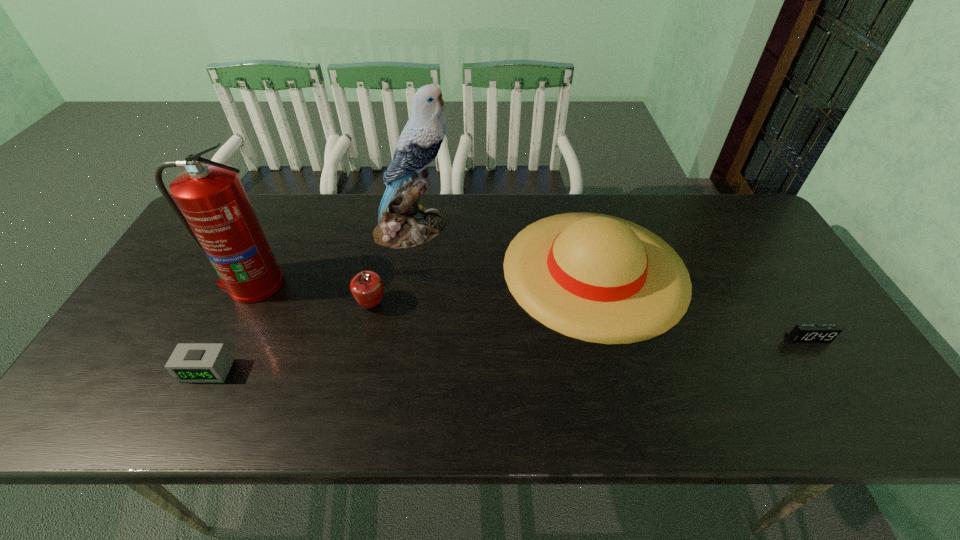
The height and width of the screenshot is (540, 960). Find the location of `blank area at the near edge`. blank area at the near edge is located at coordinates (563, 414).

Find the location of a particular element. free space at the left edge of the desktop is located at coordinates (139, 383).

Where is `unoccupied area between the shorter alarm clock and the fourth shortest object`? This screenshot has height=540, width=960. unoccupied area between the shorter alarm clock and the fourth shortest object is located at coordinates (702, 304).

Where is `unoccupied area between the third tallest object and the nearer alarm clock`? unoccupied area between the third tallest object and the nearer alarm clock is located at coordinates point(401,320).

Find the location of `free space that is in between the fifth tallest object and the sombrero`. free space that is in between the fifth tallest object and the sombrero is located at coordinates (401, 320).

Where is `free point between the fire extinguisher and the taller alarm clock`? The width and height of the screenshot is (960, 540). free point between the fire extinguisher and the taller alarm clock is located at coordinates (230, 327).

At what (x,y) coordinates should I click in order to perform the action: click on free space between the taller alarm clock and the fire extinguisher. Please return your answer as a coordinate pair (x, y). The image size is (960, 540). Looking at the image, I should click on (230, 327).

Where is `free space between the second object from right to left and the fourth tallest object`? The image size is (960, 540). free space between the second object from right to left and the fourth tallest object is located at coordinates (484, 287).

At what (x,y) coordinates should I click in order to perform the action: click on empty space that is in between the fourth tallest object and the left alarm clock. Please return your answer as a coordinate pair (x, y). This screenshot has height=540, width=960. Looking at the image, I should click on (290, 338).

Locate an element on the screen. The image size is (960, 540). vacant area between the fire extinguisher and the apple is located at coordinates (312, 294).